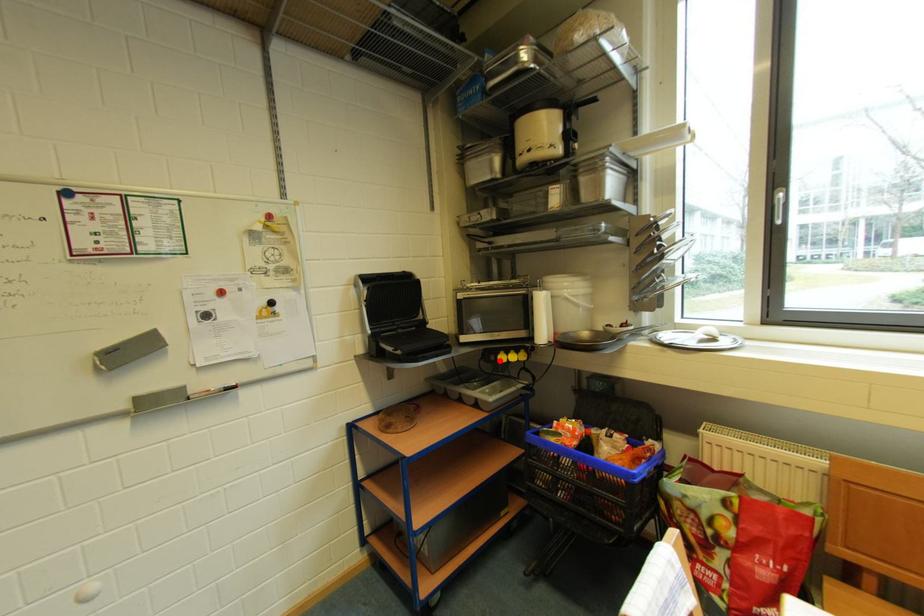
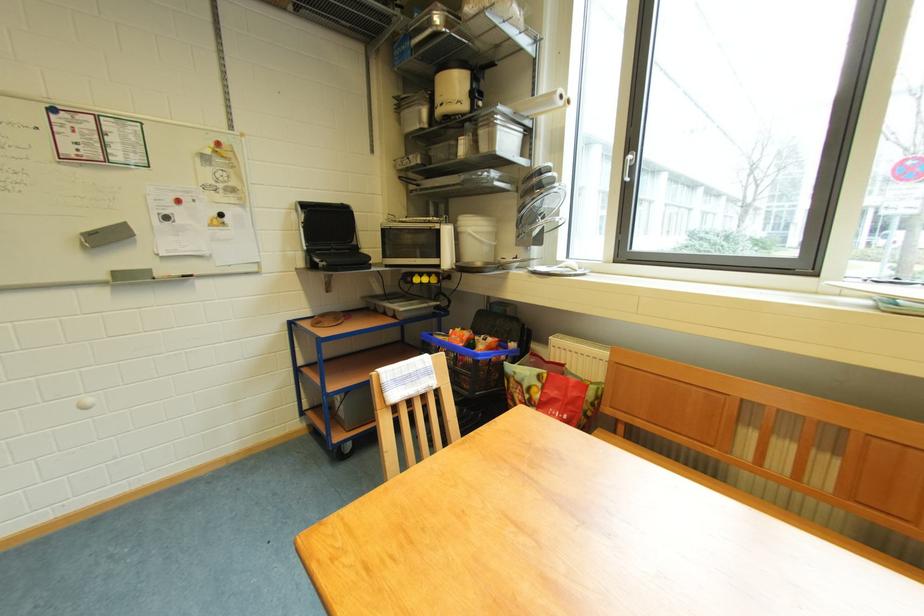
In the second image, find the point that corresponds to the highlighted location in the first image.

(417, 282)